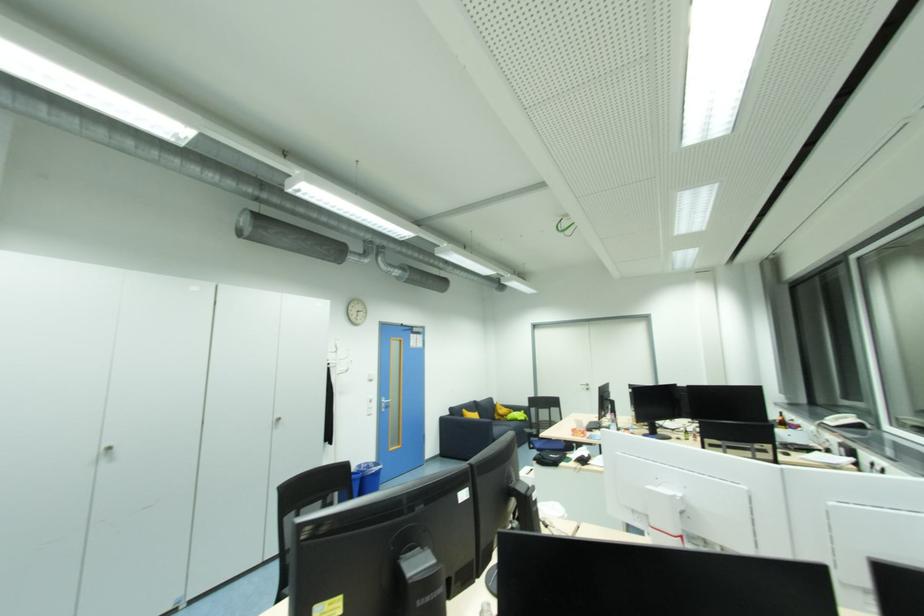
Identify the location of blue trash can. (366, 477).